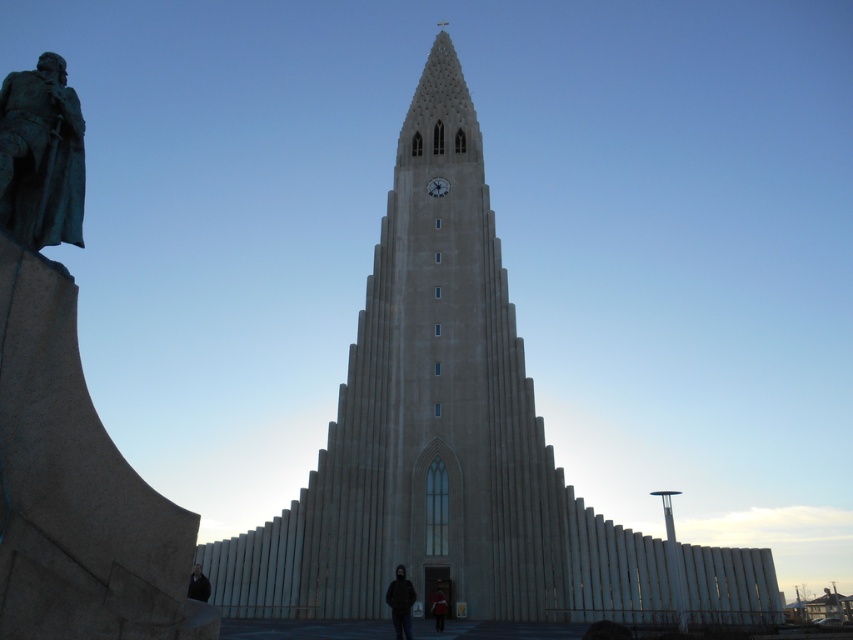
You are standing in front of the architectural structure described. You see the bronze statue at left and the dark clothing at center. Which object is positioned to the left?

The bronze statue at left is positioned to the left of dark clothing at center.

You are an artist planning to draw the scene. You want to ensure the proportions between the black matte jacket at lower center and the white stone clock at center are accurate. Which object should you draw taller in your sketch?

The black matte jacket at lower center should be drawn taller than the white stone clock at center as per the description.

You are a tourist visiting the architectural site and want to take a photo of both the dark brown leather jacket at lower center and the white stone clock at center. Which object should you position to the left in your camera frame to include both in the photo?

The dark brown leather jacket at lower center is already positioned on the left side of the white stone clock at center, so you should keep it on the left in your camera frame to include both in the photo.